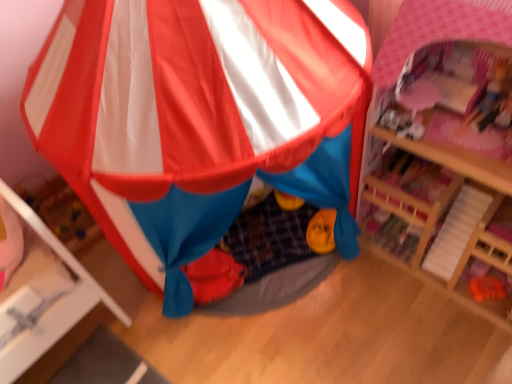
Question: From a real-world perspective, is matte plastic tent at center positioned over pink wood dollhouse at upper right based on gravity?

Choices:
 (A) no
 (B) yes

Answer: (B)

Question: Is matte plastic tent at center shorter than pink wood dollhouse at upper right?

Choices:
 (A) yes
 (B) no

Answer: (B)

Question: Is matte plastic tent at center to the left of pink wood dollhouse at upper right from the viewer's perspective?

Choices:
 (A) no
 (B) yes

Answer: (B)

Question: Is matte plastic tent at center positioned with its back to pink wood dollhouse at upper right?

Choices:
 (A) yes
 (B) no

Answer: (B)

Question: Is matte plastic tent at center far away from pink wood dollhouse at upper right?

Choices:
 (A) no
 (B) yes

Answer: (A)

Question: Does matte plastic tent at center have a greater width compared to pink wood dollhouse at upper right?

Choices:
 (A) no
 (B) yes

Answer: (B)

Question: Is pink wood dollhouse at upper right not near matte plastic tent at center?

Choices:
 (A) no
 (B) yes

Answer: (A)

Question: Considering the relative sizes of pink wood dollhouse at upper right and matte plastic tent at center in the image provided, is pink wood dollhouse at upper right bigger than matte plastic tent at center?

Choices:
 (A) no
 (B) yes

Answer: (A)

Question: From the image's perspective, would you say pink wood dollhouse at upper right is shown under matte plastic tent at center?

Choices:
 (A) no
 (B) yes

Answer: (B)

Question: Can you confirm if pink wood dollhouse at upper right is shorter than matte plastic tent at center?

Choices:
 (A) yes
 (B) no

Answer: (A)

Question: Is pink wood dollhouse at upper right smaller than matte plastic tent at center?

Choices:
 (A) no
 (B) yes

Answer: (B)

Question: Is pink wood dollhouse at upper right aimed at matte plastic tent at center?

Choices:
 (A) yes
 (B) no

Answer: (B)

Question: From the image's perspective, relative to pink wood dollhouse at upper right, is matte plastic tent at center above or below?

Choices:
 (A) below
 (B) above

Answer: (B)